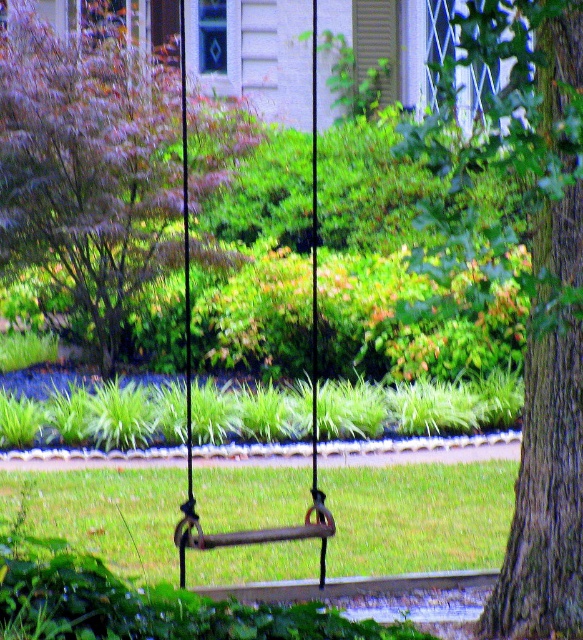
You are standing in the backyard looking at the swing. Where is the brown textured bark at right located in the image?

The brown textured bark at right is located at point (522, 276) in the image.

You are standing in the backyard and want to hang a new bird feeder between the brown textured bark at right and the purple leafy tree at upper left. Based on their positions, which object should you place the bird feeder closer to if you want it centered between them?

The bird feeder should be placed closer to the purple leafy tree at upper left since the brown textured bark at right is positioned to the right of the purple leafy tree at upper left, meaning the center point would be closer to the tree.

You are designing a garden layout and need to know the relative sizes of the brown textured bark at right and the purple leafy tree at upper left. Which one has a larger size?

The brown textured bark at right is bigger than the purple leafy tree at upper left according to the description.